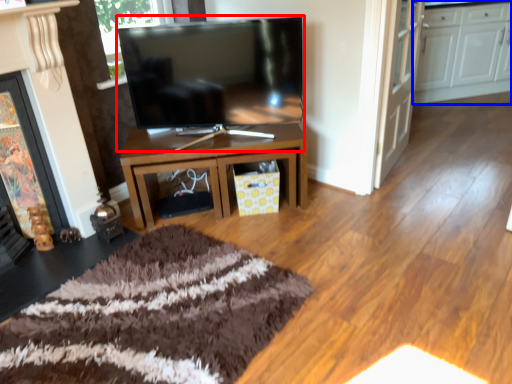
Question: Among these objects, which one is farthest to the camera, television (highlighted by a red box) or cabinetry (highlighted by a blue box)?

Choices:
 (A) television
 (B) cabinetry

Answer: (B)